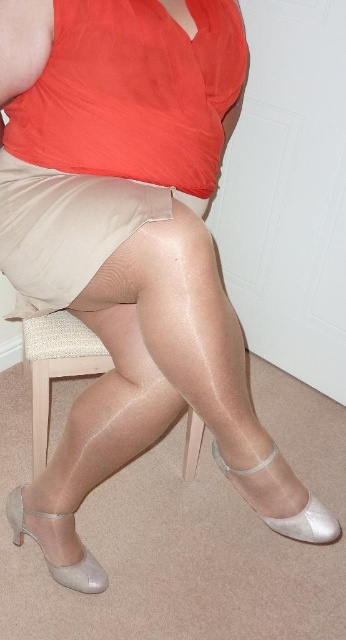
Is point (119, 234) closer to viewer compared to point (321, 525)?

Yes, point (119, 234) is in front of point (321, 525).

This screenshot has height=640, width=346. Describe the element at coordinates (112, 134) in the screenshot. I see `satin beige skirt at center` at that location.

Which is in front, point (78, 93) or point (301, 532)?

Positioned in front is point (78, 93).

The image size is (346, 640). In order to click on satin beige skirt at center in this screenshot , I will do `click(112, 134)`.

The width and height of the screenshot is (346, 640). What do you see at coordinates (112, 134) in the screenshot? I see `satin beige skirt at center` at bounding box center [112, 134].

Who is more forward, (148, 132) or (68, 586)?

Point (148, 132) is more forward.

This screenshot has height=640, width=346. Find the location of `satin beige skirt at center`. satin beige skirt at center is located at coordinates (112, 134).

Between beige fabric chair at center and satin beige sandal at lower left, which one has less height?

satin beige sandal at lower left

Image resolution: width=346 pixels, height=640 pixels. What do you see at coordinates (57, 368) in the screenshot? I see `beige fabric chair at center` at bounding box center [57, 368].

Is point (196, 420) closer to viewer compared to point (92, 561)?

No, (196, 420) is further to viewer.

At what (x,y) coordinates should I click in order to perform the action: click on beige fabric chair at center. Please return your answer as a coordinate pair (x, y). Looking at the image, I should click on (57, 368).